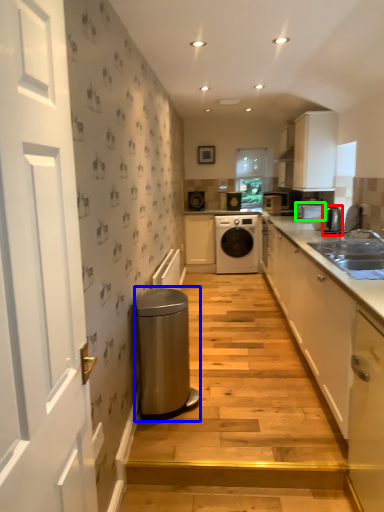
Question: Which is nearer to the appliance (highlighted by a red box)? water heater (highlighted by a blue box) or appliance (highlighted by a green box).

Choices:
 (A) water heater
 (B) appliance

Answer: (B)